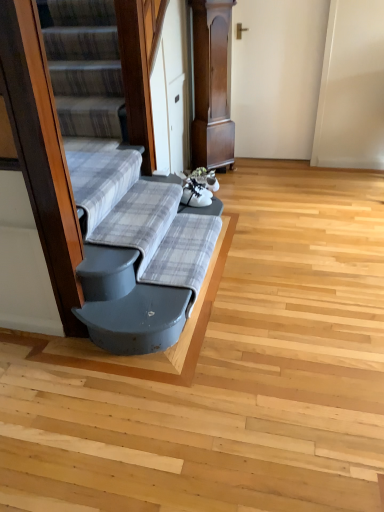
This screenshot has width=384, height=512. What are the coordinates of `plaid fabric couch at center, which is the first sheet from left to right` in the screenshot? It's located at (140, 219).

Image resolution: width=384 pixels, height=512 pixels. What do you see at coordinates (140, 219) in the screenshot? I see `plaid fabric couch at center, which is the first sheet from left to right` at bounding box center [140, 219].

Identify the location of gray plaid fabric at lower left, which appears as the first sheet when viewed from the right. (184, 254).

Describe the element at coordinates (184, 254) in the screenshot. I see `gray plaid fabric at lower left, the 2th sheet from the left` at that location.

Find the location of a particular element. The height and width of the screenshot is (512, 384). plaid fabric couch at center, which is the first sheet from left to right is located at coordinates (140, 219).

Considering the relative positions of gray plaid fabric at lower left, which appears as the first sheet when viewed from the right, and plaid fabric couch at center, which is the first sheet from left to right, in the image provided, is gray plaid fabric at lower left, which appears as the first sheet when viewed from the right, to the right of plaid fabric couch at center, which is the first sheet from left to right, from the viewer's perspective?

Yes.

Is gray plaid fabric at lower left, which appears as the first sheet when viewed from the right, positioned in front of plaid fabric couch at center, which is the first sheet from left to right?

No, it is behind plaid fabric couch at center, which is the first sheet from left to right.

Does point (213, 236) lie in front of point (155, 196)?

Yes, it is in front of point (155, 196).

Looking at this image, from the image's perspective, between gray plaid fabric at lower left, which appears as the first sheet when viewed from the right, and plaid fabric couch at center, which is the first sheet from left to right, who is located below?

gray plaid fabric at lower left, which appears as the first sheet when viewed from the right, from the image's perspective.

From a real-world perspective, is gray plaid fabric at lower left, the 2th sheet from the left, located beneath plaid fabric couch at center, arranged as the second sheet when viewed from the right?

Yes.

Which of these two, gray plaid fabric at lower left, the 2th sheet from the left, or plaid fabric couch at center, arranged as the second sheet when viewed from the right, is wider?

Wider between the two is gray plaid fabric at lower left, the 2th sheet from the left.

From their relative heights in the image, would you say gray plaid fabric at lower left, the 2th sheet from the left, is taller or shorter than plaid fabric couch at center, arranged as the second sheet when viewed from the right?

In the image, gray plaid fabric at lower left, the 2th sheet from the left, appears to be shorter than plaid fabric couch at center, arranged as the second sheet when viewed from the right.

In the scene shown: Between gray plaid fabric at lower left, the 2th sheet from the left, and plaid fabric couch at center, arranged as the second sheet when viewed from the right, which one has larger size?

plaid fabric couch at center, arranged as the second sheet when viewed from the right.

Which is correct: gray plaid fabric at lower left, the 2th sheet from the left, is inside plaid fabric couch at center, arranged as the second sheet when viewed from the right, or outside of it?

gray plaid fabric at lower left, the 2th sheet from the left, exists outside the volume of plaid fabric couch at center, arranged as the second sheet when viewed from the right.

Is gray plaid fabric at lower left, the 2th sheet from the left, positioned far away from plaid fabric couch at center, which is the first sheet from left to right?

No, gray plaid fabric at lower left, the 2th sheet from the left, is in close proximity to plaid fabric couch at center, which is the first sheet from left to right.

Is gray plaid fabric at lower left, the 2th sheet from the left, oriented towards plaid fabric couch at center, which is the first sheet from left to right?

No, gray plaid fabric at lower left, the 2th sheet from the left, is not facing towards plaid fabric couch at center, which is the first sheet from left to right.

How different are the orientations of gray plaid fabric at lower left, which appears as the first sheet when viewed from the right, and plaid fabric couch at center, which is the first sheet from left to right, in degrees?

0.000254 degrees separate the facing orientations of gray plaid fabric at lower left, which appears as the first sheet when viewed from the right, and plaid fabric couch at center, which is the first sheet from left to right.

Measure the distance from gray plaid fabric at lower left, the 2th sheet from the left, to plaid fabric couch at center, arranged as the second sheet when viewed from the right.

gray plaid fabric at lower left, the 2th sheet from the left, is 6.68 inches from plaid fabric couch at center, arranged as the second sheet when viewed from the right.

Where is `sheet on the left of gray plaid fabric at lower left, the 2th sheet from the left`? This screenshot has width=384, height=512. sheet on the left of gray plaid fabric at lower left, the 2th sheet from the left is located at coordinates (140, 219).

Considering the relative positions of plaid fabric couch at center, arranged as the second sheet when viewed from the right, and gray plaid fabric at lower left, the 2th sheet from the left, in the image provided, is plaid fabric couch at center, arranged as the second sheet when viewed from the right, to the left of gray plaid fabric at lower left, the 2th sheet from the left, from the viewer's perspective?

Correct, you'll find plaid fabric couch at center, arranged as the second sheet when viewed from the right, to the left of gray plaid fabric at lower left, the 2th sheet from the left.

Does plaid fabric couch at center, arranged as the second sheet when viewed from the right, lie in front of gray plaid fabric at lower left, the 2th sheet from the left?

Yes, plaid fabric couch at center, arranged as the second sheet when viewed from the right, is closer to the camera.

Between point (163, 228) and point (183, 214), which one is positioned in front?

Positioned in front is point (163, 228).

From the image's perspective, between plaid fabric couch at center, arranged as the second sheet when viewed from the right, and gray plaid fabric at lower left, the 2th sheet from the left, who is located below?

gray plaid fabric at lower left, the 2th sheet from the left, is shown below in the image.

From a real-world perspective, who is located higher, plaid fabric couch at center, arranged as the second sheet when viewed from the right, or gray plaid fabric at lower left, the 2th sheet from the left?

In real-world perspective, plaid fabric couch at center, arranged as the second sheet when viewed from the right, is above.

Looking at their sizes, would you say plaid fabric couch at center, arranged as the second sheet when viewed from the right, is wider or thinner than gray plaid fabric at lower left, which appears as the first sheet when viewed from the right?

Considering their sizes, plaid fabric couch at center, arranged as the second sheet when viewed from the right, looks slimmer than gray plaid fabric at lower left, which appears as the first sheet when viewed from the right.

In terms of height, does plaid fabric couch at center, arranged as the second sheet when viewed from the right, look taller or shorter compared to gray plaid fabric at lower left, the 2th sheet from the left?

In the image, plaid fabric couch at center, arranged as the second sheet when viewed from the right, appears to be taller than gray plaid fabric at lower left, the 2th sheet from the left.

Considering the sizes of objects plaid fabric couch at center, arranged as the second sheet when viewed from the right, and gray plaid fabric at lower left, which appears as the first sheet when viewed from the right, in the image provided, who is bigger, plaid fabric couch at center, arranged as the second sheet when viewed from the right, or gray plaid fabric at lower left, which appears as the first sheet when viewed from the right,?

With larger size is plaid fabric couch at center, arranged as the second sheet when viewed from the right.

Is plaid fabric couch at center, which is the first sheet from left to right, surrounding gray plaid fabric at lower left, which appears as the first sheet when viewed from the right?

No, gray plaid fabric at lower left, which appears as the first sheet when viewed from the right, is not a part of plaid fabric couch at center, which is the first sheet from left to right.

Looking at this image, are plaid fabric couch at center, which is the first sheet from left to right, and gray plaid fabric at lower left, the 2th sheet from the left, located far from each other?

They are positioned close to each other.

Is plaid fabric couch at center, arranged as the second sheet when viewed from the right, facing towards gray plaid fabric at lower left, the 2th sheet from the left?

No.

Where is `sheet located above the gray plaid fabric at lower left, which appears as the first sheet when viewed from the right (from the image's perspective)`? Image resolution: width=384 pixels, height=512 pixels. sheet located above the gray plaid fabric at lower left, which appears as the first sheet when viewed from the right (from the image's perspective) is located at coordinates (140, 219).

The height and width of the screenshot is (512, 384). What are the coordinates of `sheet on the left of gray plaid fabric at lower left, the 2th sheet from the left` in the screenshot? It's located at (140, 219).

Locate an element on the screen. The height and width of the screenshot is (512, 384). sheet that is above the gray plaid fabric at lower left, which appears as the first sheet when viewed from the right (from the image's perspective) is located at coordinates (140, 219).